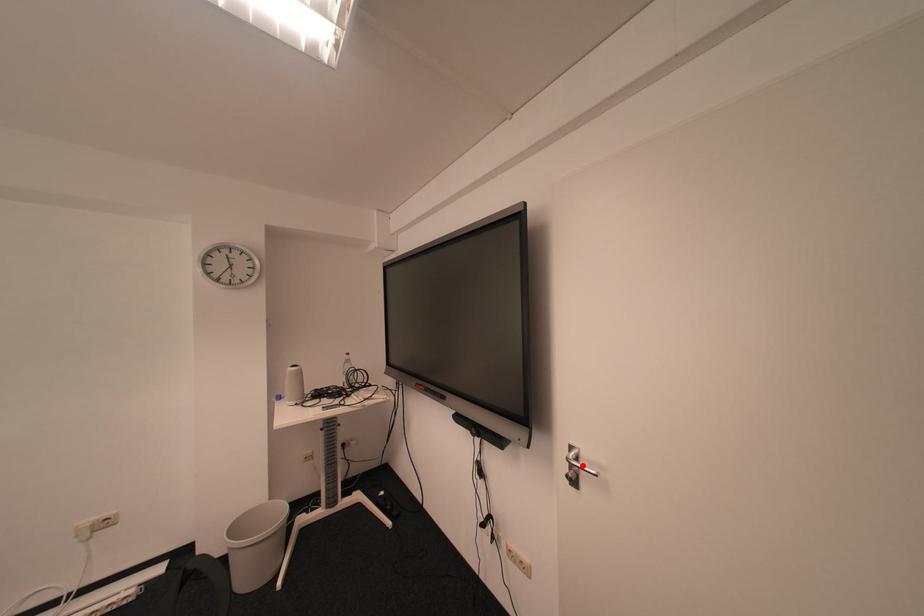
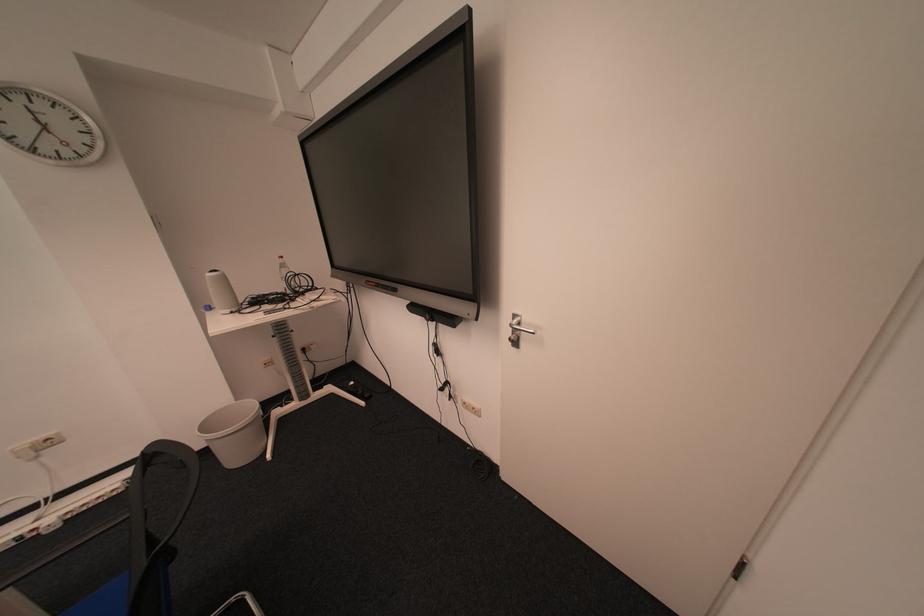
Question: I am providing you with two images of the same scene from different viewpoints. A red point is marked on the first image. Is the red point's position out of view in image 2?

Choices:
 (A) Yes
 (B) No

Answer: (B)